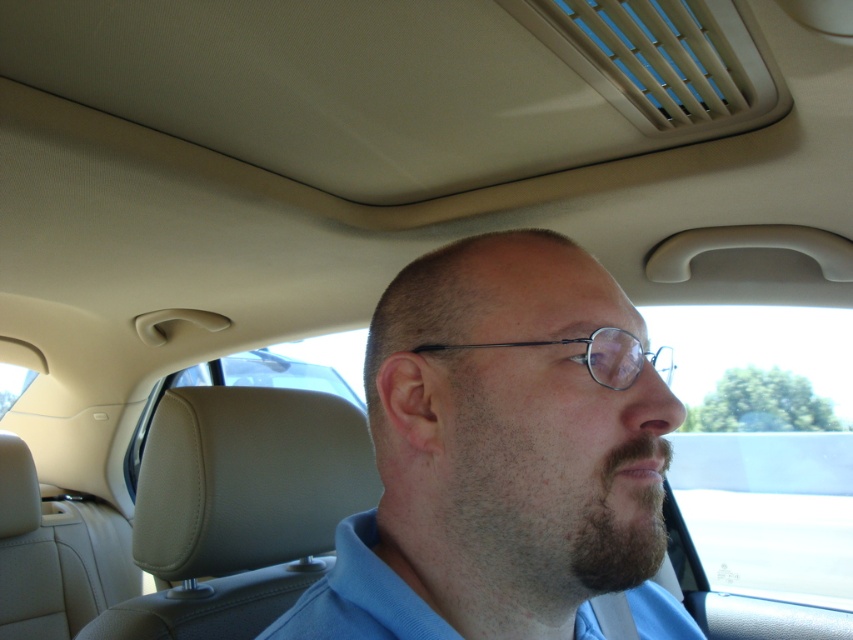
Question: Which point is farther from the camera taking this photo?

Choices:
 (A) (409, 604)
 (B) (564, 237)

Answer: (B)

Question: Can you confirm if blue fabric shirt at center is smaller than blue cotton shirt at center?

Choices:
 (A) no
 (B) yes

Answer: (A)

Question: Does blue fabric shirt at center have a smaller size compared to blue cotton shirt at center?

Choices:
 (A) no
 (B) yes

Answer: (A)

Question: Considering the relative positions of blue fabric shirt at center and blue cotton shirt at center in the image provided, where is blue fabric shirt at center located with respect to blue cotton shirt at center?

Choices:
 (A) below
 (B) above

Answer: (B)